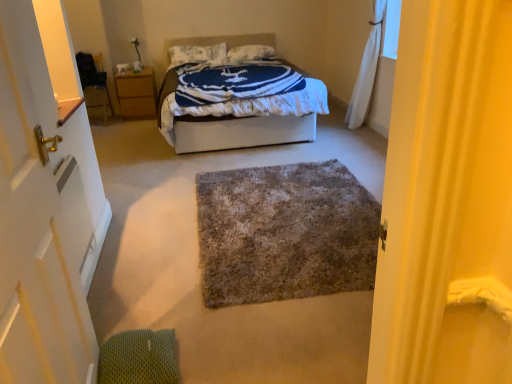
Question: Considering the relative sizes of white wooden door at left and white soft pillow at upper center, the 1th pillow from the left, in the image provided, is white wooden door at left shorter than white soft pillow at upper center, the 1th pillow from the left,?

Choices:
 (A) yes
 (B) no

Answer: (B)

Question: Is the depth of white wooden door at left less than that of white soft pillow at upper center, arranged as the 2th pillow when viewed from the right?

Choices:
 (A) yes
 (B) no

Answer: (A)

Question: Is white wooden door at left with white soft pillow at upper center, the 1th pillow from the left?

Choices:
 (A) no
 (B) yes

Answer: (A)

Question: Could you tell me if white wooden door at left is turned towards white soft pillow at upper center, the 1th pillow from the left?

Choices:
 (A) no
 (B) yes

Answer: (A)

Question: Does white wooden door at left have a greater height compared to white soft pillow at upper center, arranged as the 2th pillow when viewed from the right?

Choices:
 (A) no
 (B) yes

Answer: (B)

Question: Is white fabric bed at center taller or shorter than shaggy gray rug at center?

Choices:
 (A) tall
 (B) short

Answer: (A)

Question: Is white fabric bed at center in front of or behind shaggy gray rug at center in the image?

Choices:
 (A) behind
 (B) front

Answer: (A)

Question: Is white fabric bed at center bigger or smaller than shaggy gray rug at center?

Choices:
 (A) big
 (B) small

Answer: (A)

Question: From a real-world perspective, relative to shaggy gray rug at center, is white fabric bed at center vertically above or below?

Choices:
 (A) below
 (B) above

Answer: (B)

Question: Is point (256, 59) positioned closer to the camera than point (301, 259)?

Choices:
 (A) closer
 (B) farther

Answer: (B)

Question: Looking at their shapes, would you say white soft pillow at center, which is the 1th pillow from right to left, is wider or thinner than shaggy gray rug at center?

Choices:
 (A) thin
 (B) wide

Answer: (A)

Question: Considering the positions of white soft pillow at center, which is the 1th pillow from right to left, and shaggy gray rug at center in the image, is white soft pillow at center, which is the 1th pillow from right to left, taller or shorter than shaggy gray rug at center?

Choices:
 (A) tall
 (B) short

Answer: (A)

Question: Is white soft pillow at center, the second pillow viewed from the left, bigger or smaller than shaggy gray rug at center?

Choices:
 (A) small
 (B) big

Answer: (A)

Question: Looking at their shapes, would you say shaggy gray rug at center is wider or thinner than white sheer curtain at upper right?

Choices:
 (A) wide
 (B) thin

Answer: (A)

Question: Which is correct: shaggy gray rug at center is inside white sheer curtain at upper right, or outside of it?

Choices:
 (A) inside
 (B) outside

Answer: (B)